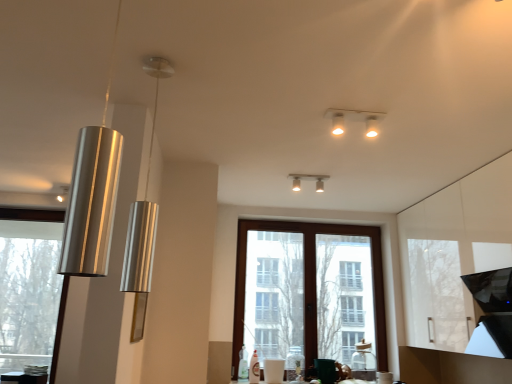
Question: From a real-world perspective, relative to brown wooden window at center, the 2th window when ordered from left to right, is white glossy light fixture at upper center, acting as the first lamp starting from the right, vertically above or below?

Choices:
 (A) above
 (B) below

Answer: (A)

Question: Is white glossy light fixture at upper center, acting as the first lamp starting from the right, to the left or to the right of brown wooden window at center, which ranks as the 1th window in right-to-left order, in the image?

Choices:
 (A) left
 (B) right

Answer: (A)

Question: Considering the real-world distances, which object is closest to the metallic cylinder at left, marked as the 1th lamp in a left-to-right arrangement?

Choices:
 (A) brown wooden window at center, the 2th window when ordered from left to right
 (B) white glossy light fixture at upper center, marked as the third lamp in a front-to-back arrangement
 (C) silver/metallic pendant light at left, positioned as the 2th lamp in front-to-back order
 (D) shiny metallic pendant light at left, positioned as the 1th lamp in front-to-back order
 (E) clear glass window at left, which ranks as the second window in right-to-left order

Answer: (E)

Question: Based on their relative distances, which object is farther from the shiny metallic pendant light at left, the fifth lamp when ordered from back to front?

Choices:
 (A) brown wooden window at center, the 2th window when ordered from left to right
 (B) white glossy light fixture at upper center, acting as the first lamp starting from the right
 (C) metallic cylinder at left, which appears as the 5th lamp when viewed from the right
 (D) matte silver light fixture at upper center, positioned as the 4th lamp in front-to-back order
 (E) silver/metallic pendant light at left, which is the 2th lamp from left to right

Answer: (A)